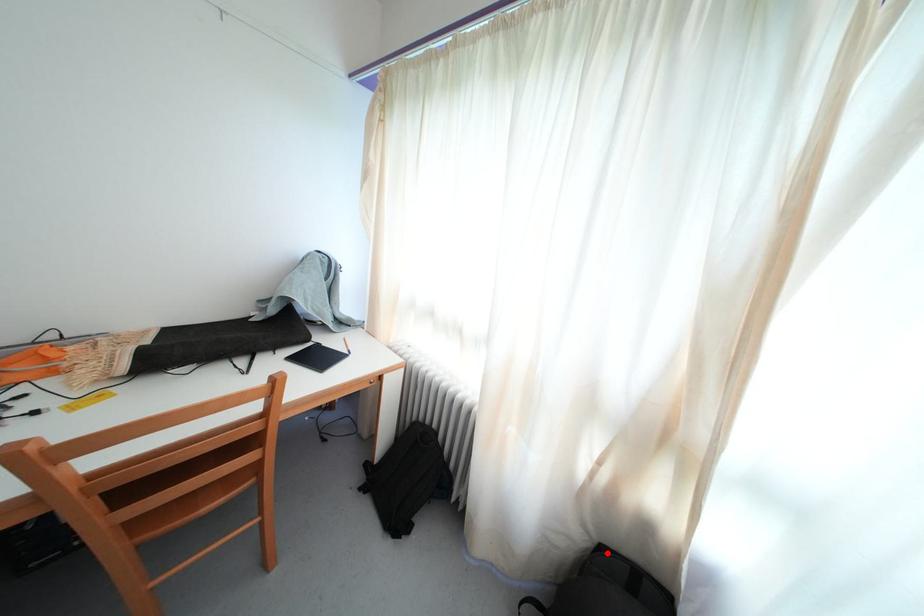
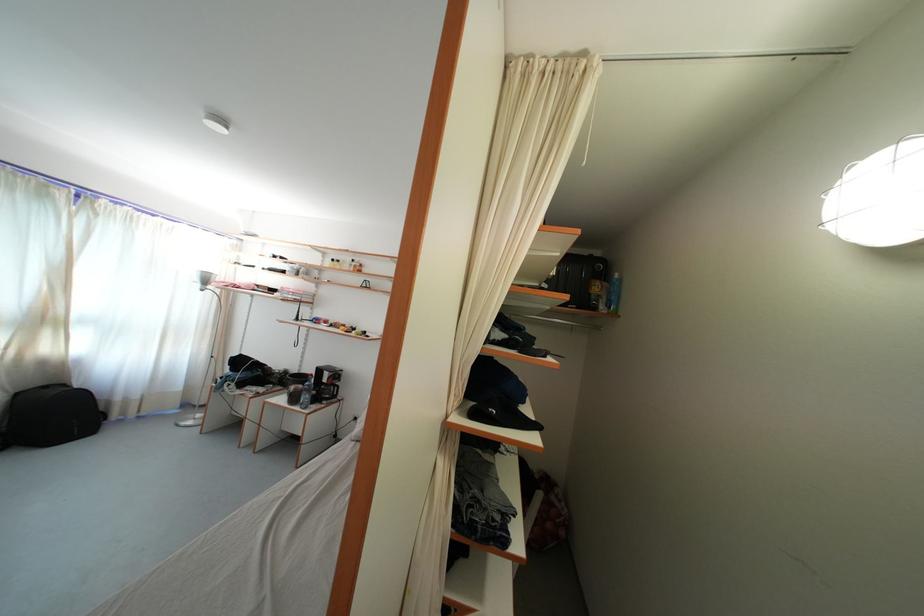
Find the pixel in the second image that matches the highlighted location in the first image.

(23, 400)